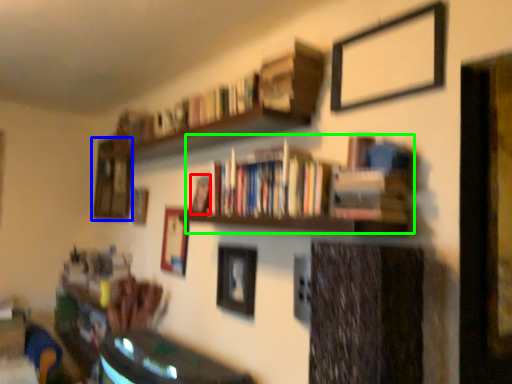
Question: Estimate the real-world distances between objects in this image. Which object is closer to book (highlighted by a red box), picture frame (highlighted by a blue box) or book (highlighted by a green box)?

Choices:
 (A) picture frame
 (B) book

Answer: (B)